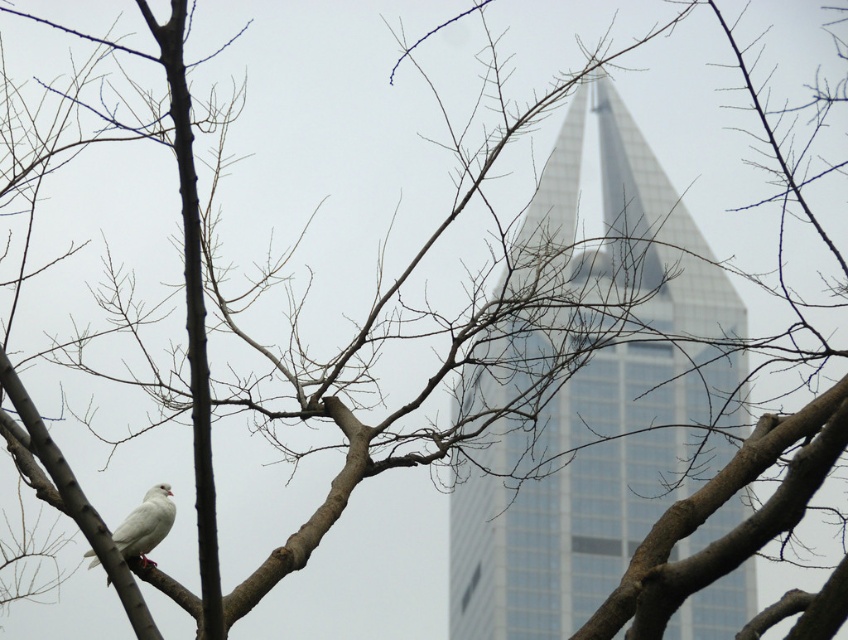
Question: Can you confirm if glassy silver tower at center is wider than brown rough tree branch at center?

Choices:
 (A) yes
 (B) no

Answer: (A)

Question: Which point appears farthest from the camera in this image?

Choices:
 (A) (745, 532)
 (B) (163, 515)
 (C) (636, 173)

Answer: (C)

Question: Can you confirm if glassy silver tower at center is smaller than white matte bird at lower left?

Choices:
 (A) no
 (B) yes

Answer: (A)

Question: Estimate the real-world distances between objects in this image. Which object is closer to the brown rough tree branch at center?

Choices:
 (A) white matte bird at lower left
 (B) glassy silver tower at center

Answer: (A)

Question: Which of the following is the closest to the observer?

Choices:
 (A) (536, 440)
 (B) (698, 573)

Answer: (B)

Question: Does brown rough tree branch at center appear over white matte bird at lower left?

Choices:
 (A) no
 (B) yes

Answer: (B)